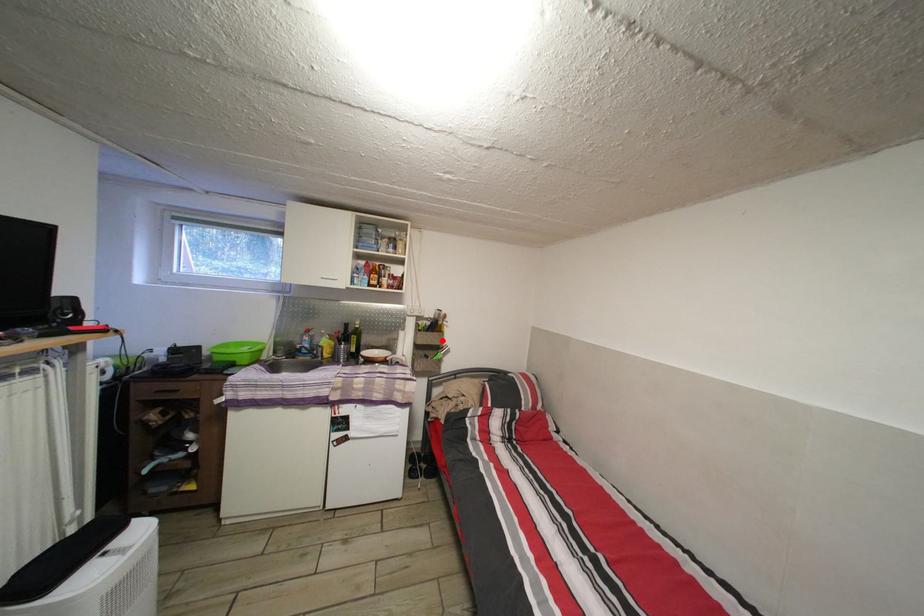
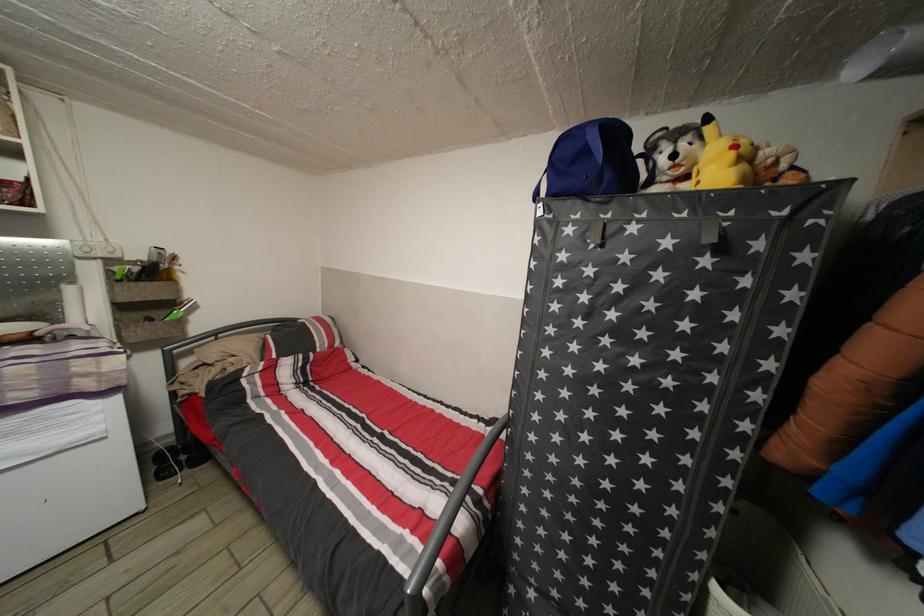
The point at the highlighted location is marked in the first image. Where is the corresponding point in the second image?

(164, 291)